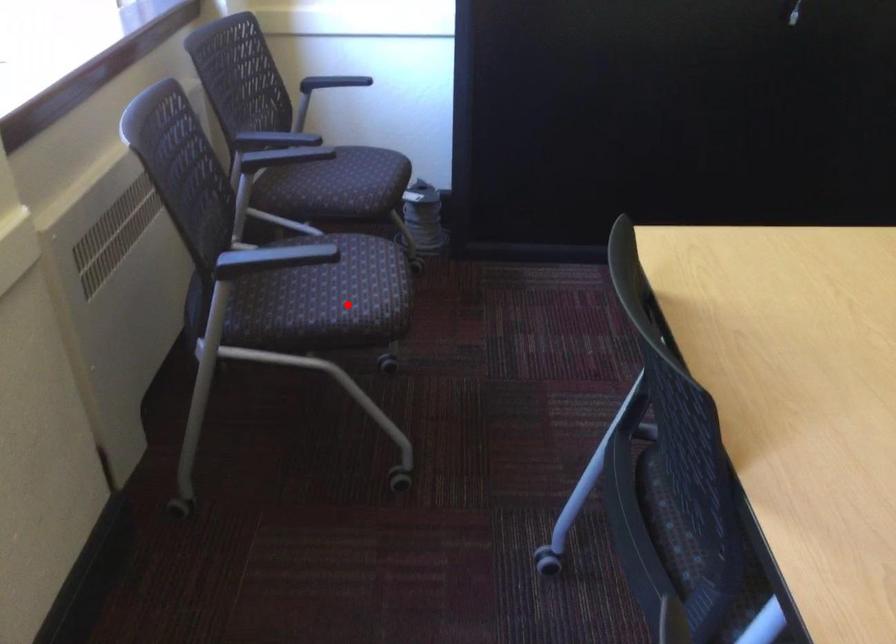
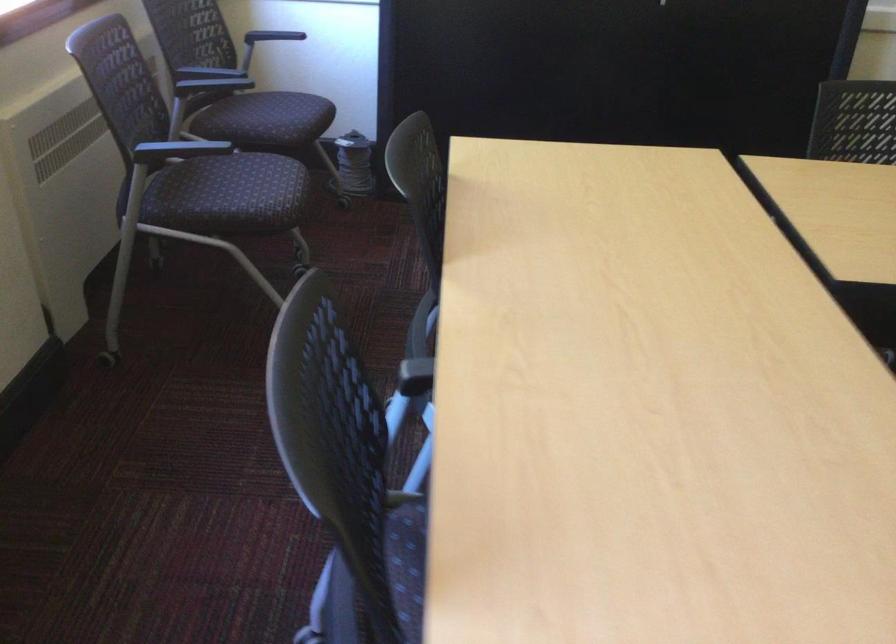
Question: I am providing you with two images of the same scene from different viewpoints. Image1 has a red point marked. In image2, the corresponding 3D location appears at what relative position? Reply with the corresponding letter.

Choices:
 (A) Closer
 (B) Farther

Answer: (B)